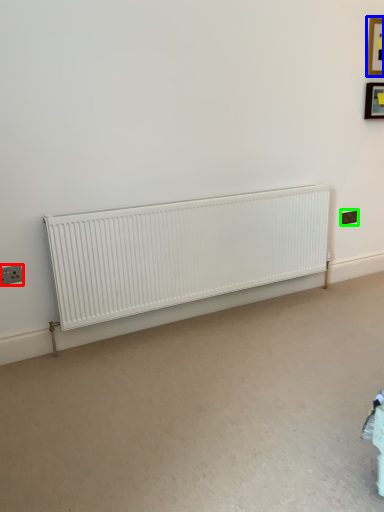
Question: Based on their relative distances, which object is farther from electric outlet (highlighted by a red box)? Choose from picture frame (highlighted by a blue box) and electric outlet (highlighted by a green box).

Choices:
 (A) picture frame
 (B) electric outlet

Answer: (A)